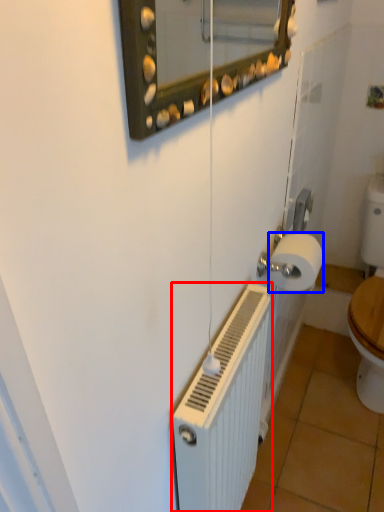
Question: Which point is closer to the camera, radiator (highlighted by a red box) or toilet paper (highlighted by a blue box)?

Choices:
 (A) radiator
 (B) toilet paper

Answer: (A)